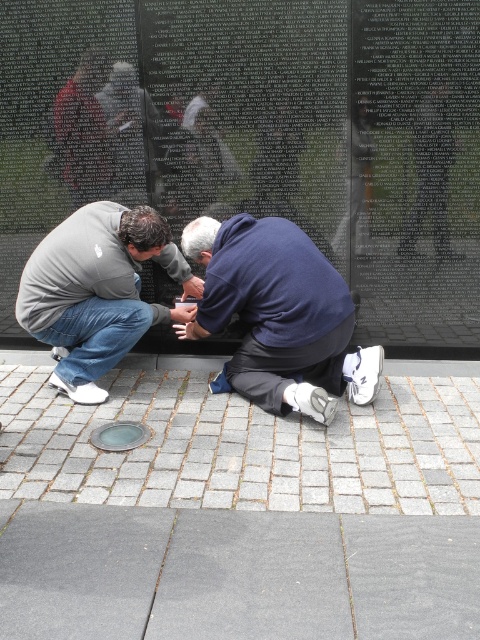
Describe the element at coordinates (243, 445) in the screenshot. I see `gray brick pavement at lower center` at that location.

Who is lower down, gray brick pavement at lower center or gray matte hoodie at lower left?

gray brick pavement at lower center is lower down.

Where is `gray brick pavement at lower center`? This screenshot has height=640, width=480. gray brick pavement at lower center is located at coordinates (243, 445).

Which of these two, gray brick pavement at lower center or blue fabric at center, stands taller?

Standing taller between the two is blue fabric at center.

Between point (29, 442) and point (298, 392), which one is positioned in front?

Positioned in front is point (29, 442).

Between point (453, 436) and point (215, 260), which one is positioned behind?

The point (215, 260) is behind.

In order to click on gray brick pavement at lower center in this screenshot , I will do `click(243, 445)`.

Based on the photo, does gray concrete pavement at lower center have a larger size compared to gray matte hoodie at lower left?

No, gray concrete pavement at lower center is not bigger than gray matte hoodie at lower left.

Which is behind, point (197, 536) or point (72, 250)?

Point (72, 250)

Locate an element on the screen. gray concrete pavement at lower center is located at coordinates (235, 573).